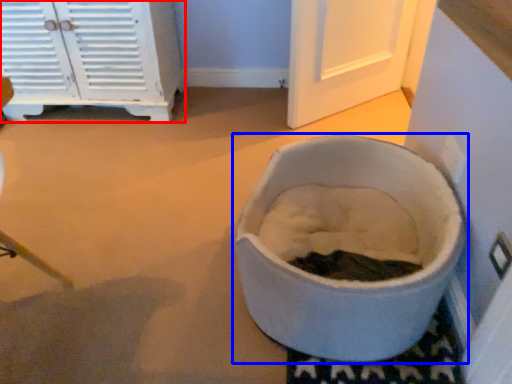
Question: Which object is closer to the camera taking this photo, cabinetry (highlighted by a red box) or toilet (highlighted by a blue box)?

Choices:
 (A) cabinetry
 (B) toilet

Answer: (B)